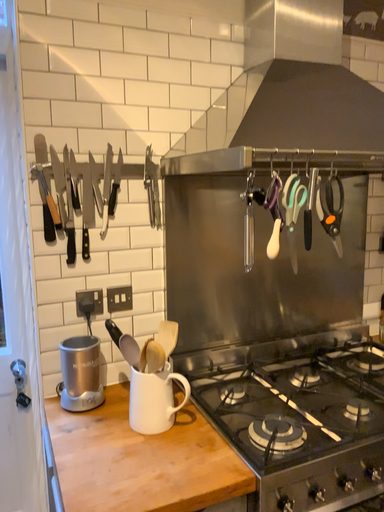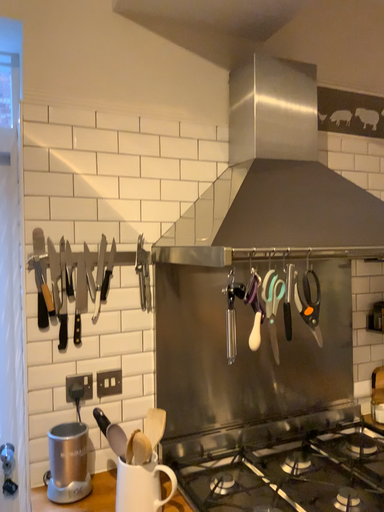
Question: How did the camera likely rotate when shooting the video?

Choices:
 (A) rotated downward
 (B) rotated upward

Answer: (B)